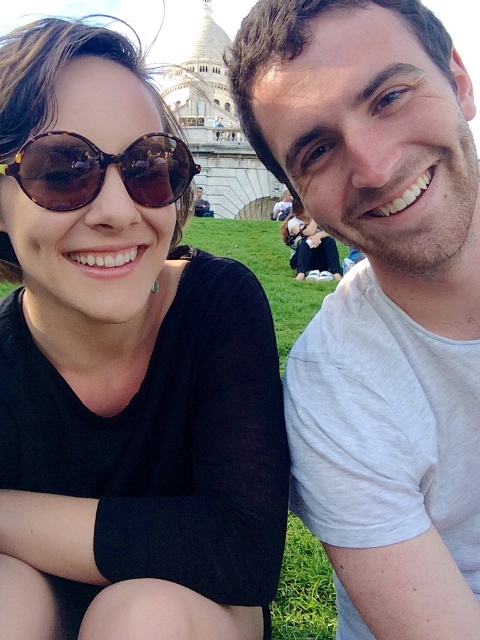
Which is more to the left, tortoiseshell sunglasses at upper left or stone tower at upper center?

Positioned to the left is stone tower at upper center.

Measure the distance between tortoiseshell sunglasses at upper left and stone tower at upper center.

They are 73.88 meters apart.

At what (x,y) coordinates should I click in order to perform the action: click on tortoiseshell sunglasses at upper left. Please return your answer as a coordinate pair (x, y). The height and width of the screenshot is (640, 480). Looking at the image, I should click on (124, 368).

Is point (276, 33) closer to viewer compared to point (68, 188)?

Yes, point (276, 33) is closer to viewer.

Which of these two, white cotton t-shirt at center or brown tortoiseshell sunglasses at left, stands taller?

With more height is white cotton t-shirt at center.

Does point (439, 481) come in front of point (158, 148)?

No, (439, 481) is behind (158, 148).

The height and width of the screenshot is (640, 480). What are the coordinates of `white cotton t-shirt at center` in the screenshot? It's located at (380, 300).

Which is in front, point (49, 116) or point (132, 168)?

Positioned in front is point (49, 116).

Is tortoiseshell sunglasses at upper left to the left of brown tortoiseshell sunglasses at left from the viewer's perspective?

No, tortoiseshell sunglasses at upper left is not to the left of brown tortoiseshell sunglasses at left.

From the picture: Measure the distance between tortoiseshell sunglasses at upper left and camera.

tortoiseshell sunglasses at upper left is 134.45 feet from camera.

Locate an element on the screen. The width and height of the screenshot is (480, 640). tortoiseshell sunglasses at upper left is located at coordinates (124, 368).